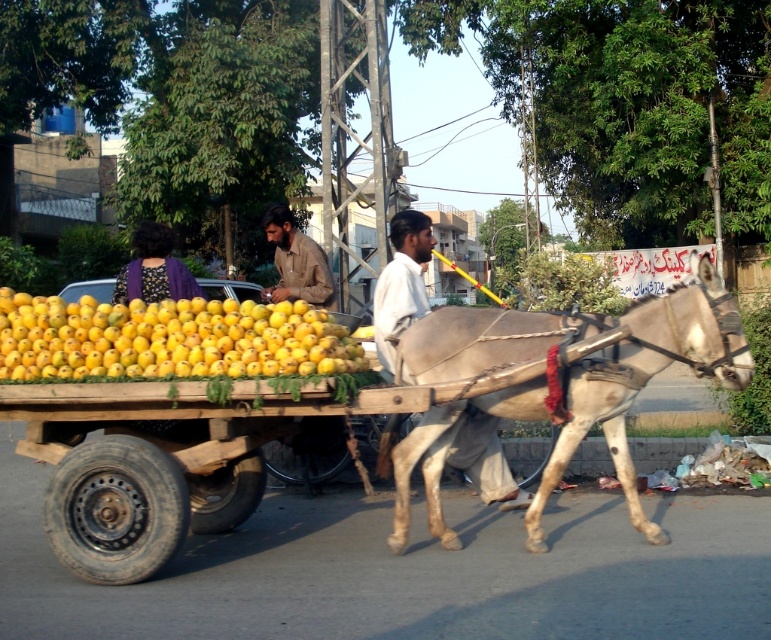
You are standing on the rural street scene and want to determine which of the two points, point (633, 353) or point (136, 237), is nearer to you. Based on the image, which point is closer?

Point (633, 353) is closer to the viewer than point (136, 237).

You are a farmer who wants to load more mangoes onto the cart. The cart has limited height capacity. Based on the scene, can you determine if the yellow matte mangoes at center can be stacked higher than the brown cotton shirt at center?

The yellow matte mangoes at center is not as tall as brown cotton shirt at center, so they can be stacked higher than the brown cotton shirt at center.